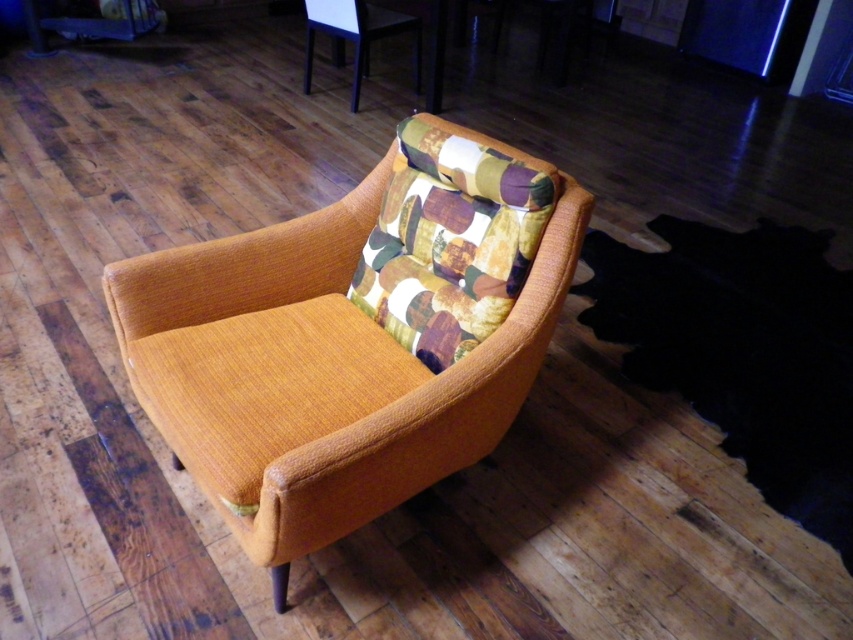
Question: Which point is farther to the camera?

Choices:
 (A) mustard fabric armchair at center
 (B) textured fabric chair at upper center

Answer: (B)

Question: Can you confirm if mustard fabric armchair at center is positioned above textured fabric chair at upper center?

Choices:
 (A) no
 (B) yes

Answer: (A)

Question: Is the position of mustard fabric armchair at center more distant than that of textured fabric chair at upper center?

Choices:
 (A) yes
 (B) no

Answer: (B)

Question: Which object appears farthest from the camera in this image?

Choices:
 (A) textured fabric chair at upper center
 (B) mustard fabric armchair at center

Answer: (A)

Question: Is mustard fabric armchair at center to the left of textured fabric chair at upper center from the viewer's perspective?

Choices:
 (A) yes
 (B) no

Answer: (B)